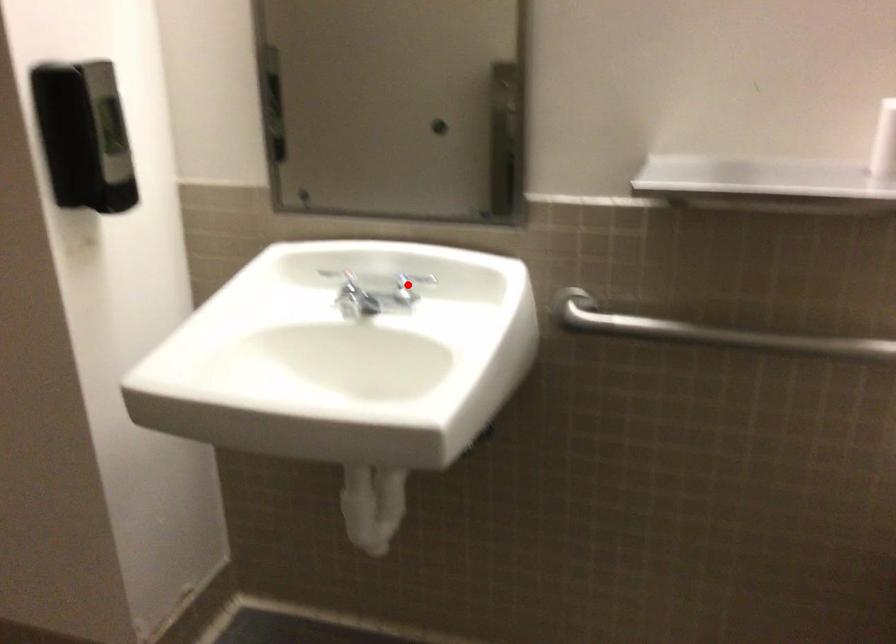
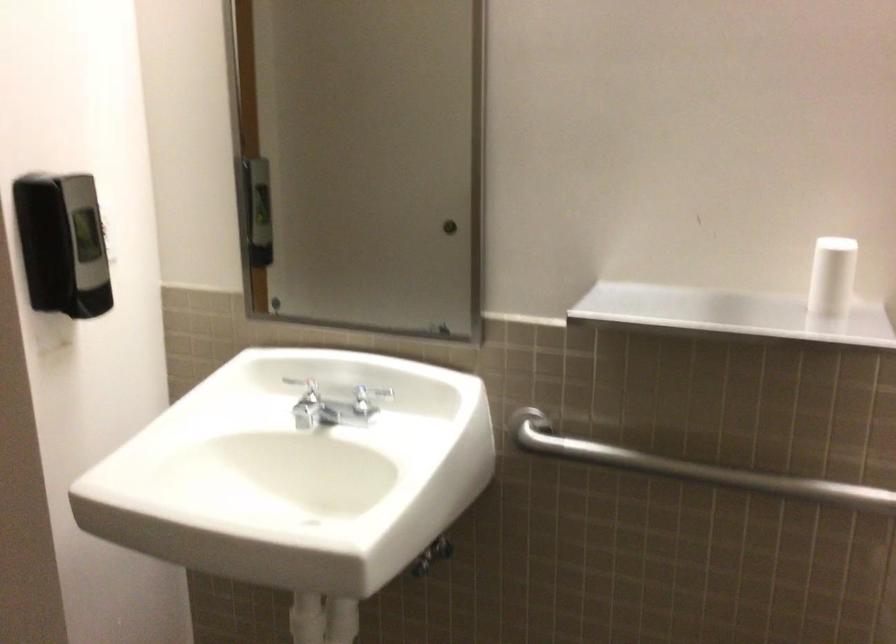
Find the pixel in the second image that matches the highlighted location in the first image.

(368, 397)